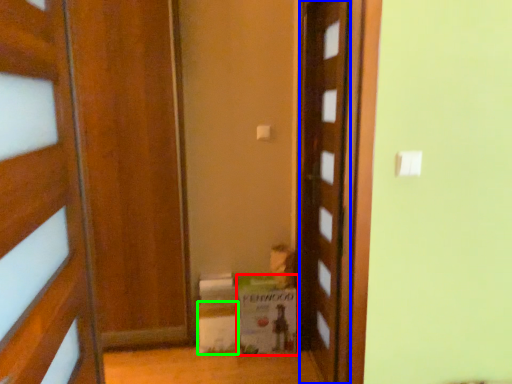
Question: Which is nearer to the cardboard box (highlighted by a red box)? door (highlighted by a blue box) or cardboard box (highlighted by a green box).

Choices:
 (A) door
 (B) cardboard box

Answer: (B)